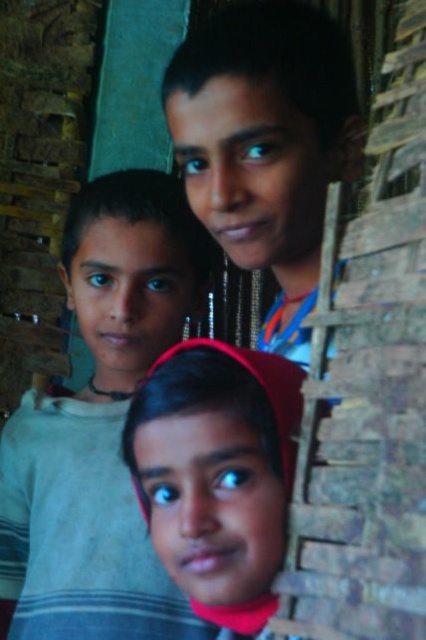
In the scene with three children standing against a rustic brick wall, you notice a light gray striped shirt at center and a smooth skin face at center. Which object is positioned higher up in the image?

The light gray striped shirt at center is much taller as smooth skin face at center, so the light gray striped shirt at center is positioned higher up in the image.

You are a photographer trying to capture a group photo of the children. You need to ensure that the light gray striped shirt at center and the pink fabric headscarf at center are clearly visible in the frame. Given their proximity, do you think adjusting the camera focus to 12 inches will ensure both are in focus?

The light gray striped shirt at center is 12.34 inches from the pink fabric headscarf at center. Since the focus adjustment is set to 12 inches, there might be a slight blur in the image because the distance between them exceeds the focus range. It is recommended to adjust the focus to at least 13 inches to ensure both are in clear focus.

You are a photographer trying to focus on the smooth skin face at center and the light gray striped shirt at center. Which object should you adjust your camera focus on first if you want to ensure both are in focus?

The smooth skin face at center is above the light gray striped shirt at center, so you should focus on the smooth skin face at center first to ensure both are in focus.